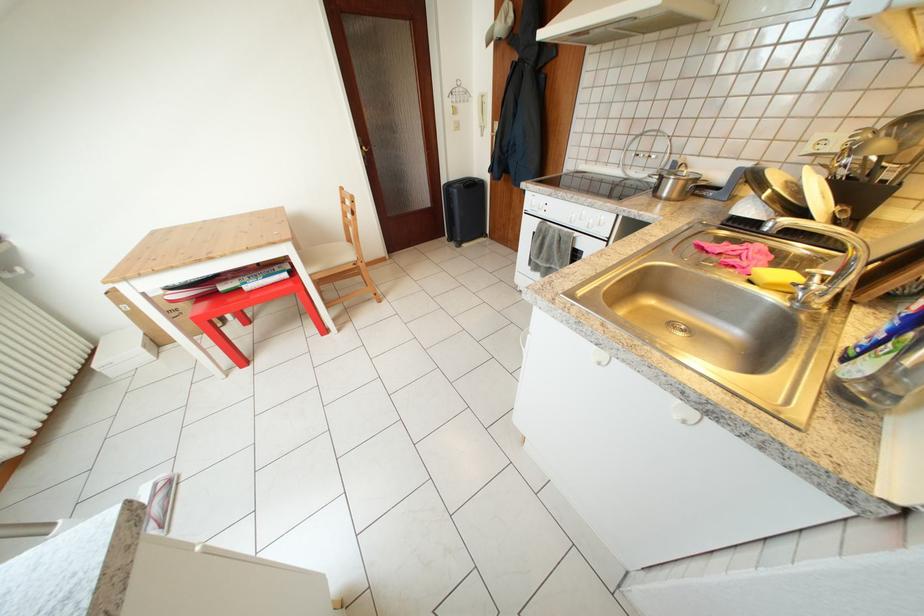
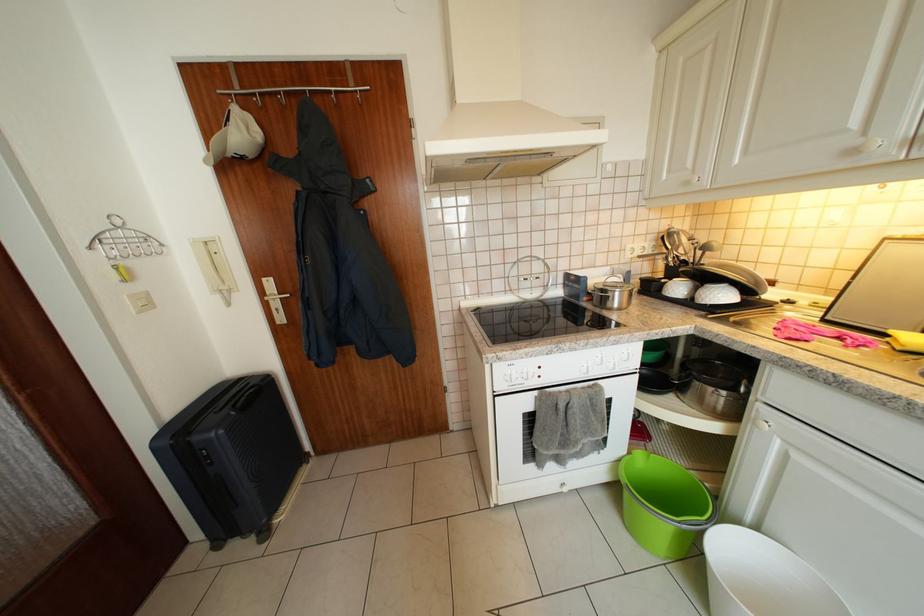
Where in the second image is the point corresponding to point 678,187 from the first image?

(626, 299)